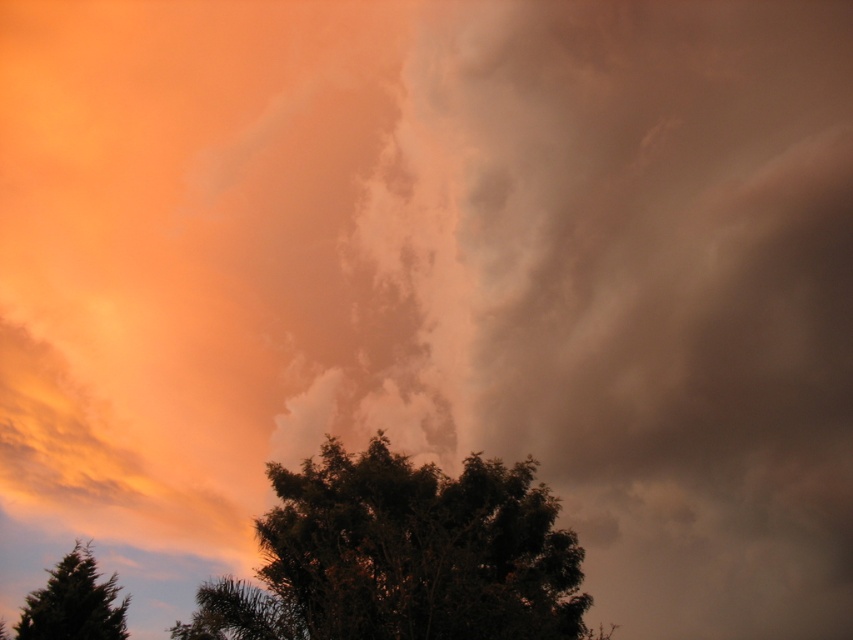
You are standing in a field and see the green leafy tree at lower center and the green matte tree at lower left. Which tree is closer to you?

The green leafy tree at lower center is closer to you because it is positioned in front of the green matte tree at lower left.

You are standing in the foreground of the scene and want to walk from the green matte tree at lower left to the green leafy tree at lower center. Which direction should you move relative to the trees?

You should move towards the right to go from the green matte tree at lower left to the green leafy tree at lower center since the green leafy tree at lower center is positioned to the right of the green matte tree at lower left.